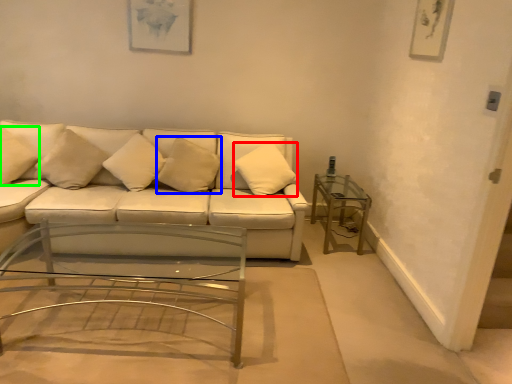
Question: Which object is the farthest from pillow (highlighted by a red box)? Choose among these: pillow (highlighted by a blue box) or pillow (highlighted by a green box).

Choices:
 (A) pillow
 (B) pillow

Answer: (B)